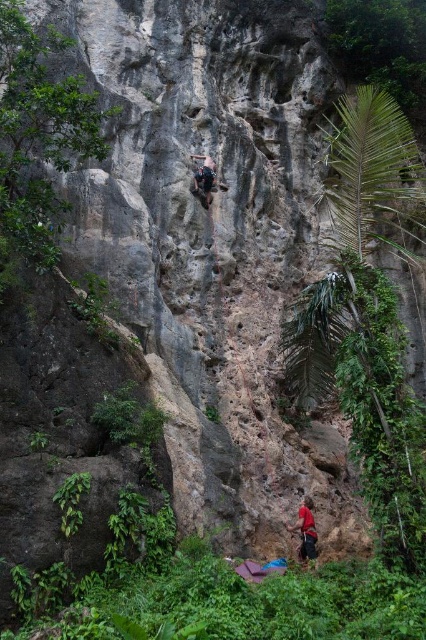
You are a climber trying to reach the top of the cliff. You notice the red fabric pants at lower center and the matte black climbing harness at center. Which object is positioned to the right side from your perspective?

The red fabric pants at lower center is positioned to the right of the matte black climbing harness at center.

In the scene shown: You are standing at the base of the cliff and want to reach the point marked as point (x=305, y=516) on the cliff. The distance between you and the point is 58.59 meters. If your climbing gear can handle a maximum distance of 60 meters, will you be able to safely reach the point?

The distance between you and point (x=305, y=516) is 58.59 meters, which is within the 60 meters maximum capacity of your gear. Therefore, you can safely reach the point.